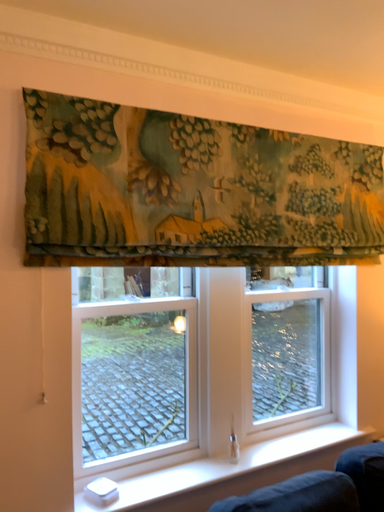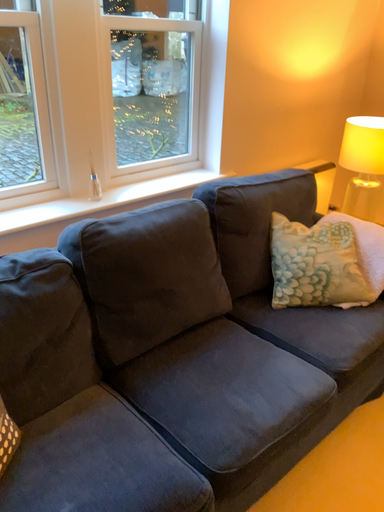
Question: Which way did the camera rotate in the video?

Choices:
 (A) rotated right
 (B) rotated left

Answer: (A)